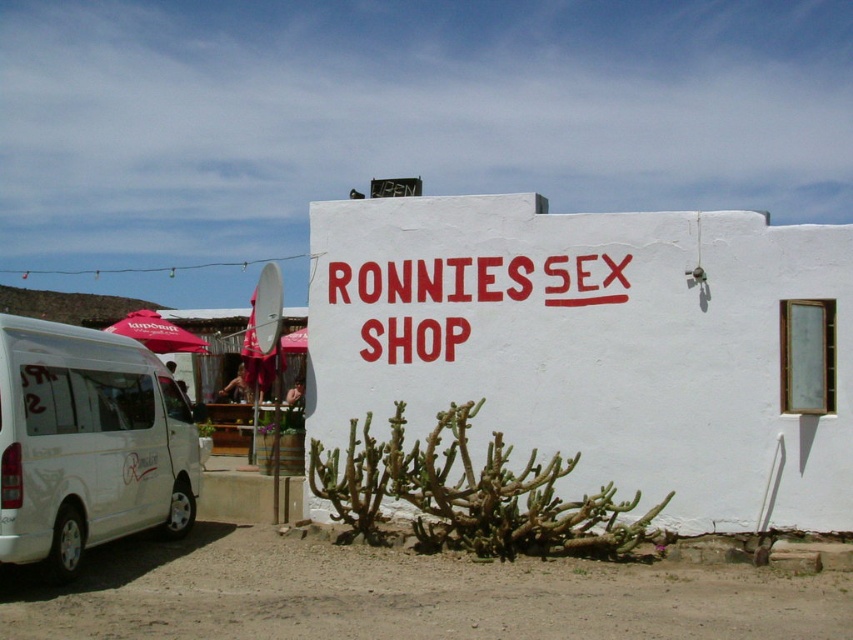
Question: Which object appears farthest from the camera in this image?

Choices:
 (A) white matte van at lower left
 (B) red painted sign at center
 (C) red fabric umbrella at left

Answer: (C)

Question: Among these points, which one is nearest to the camera?

Choices:
 (A) (96, 454)
 (B) (303, 326)

Answer: (A)

Question: Observing the image, what is the correct spatial positioning of red painted sign at center in reference to white matte van at lower left?

Choices:
 (A) above
 (B) below

Answer: (A)

Question: Can you confirm if red painted sign at center is thinner than red fabric umbrella at center?

Choices:
 (A) yes
 (B) no

Answer: (B)

Question: Among these points, which one is farthest from the camera?

Choices:
 (A) (524, 310)
 (B) (173, 333)
 (C) (305, 342)

Answer: (C)

Question: Is red painted sign at center to the left of red fabric umbrella at left from the viewer's perspective?

Choices:
 (A) yes
 (B) no

Answer: (B)